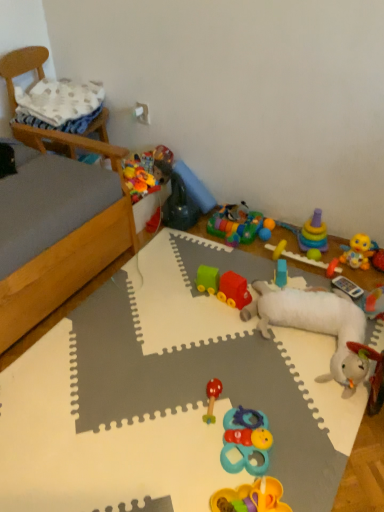
Locate an element on the screen. The width and height of the screenshot is (384, 512). free spot to the right of blue plastic toy at center, which is counted as the sixth toy, starting from the top is located at coordinates (308, 279).